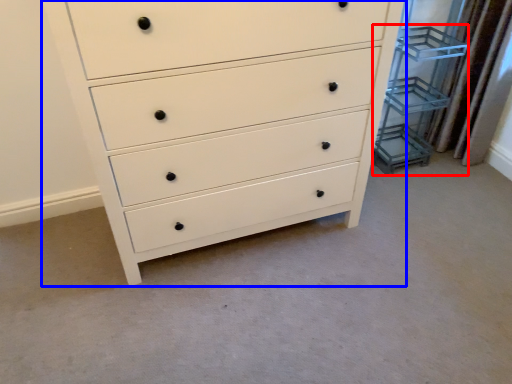
Question: Among these objects, which one is nearest to the camera, cabinet (highlighted by a red box) or chest of drawers (highlighted by a blue box)?

Choices:
 (A) cabinet
 (B) chest of drawers

Answer: (B)